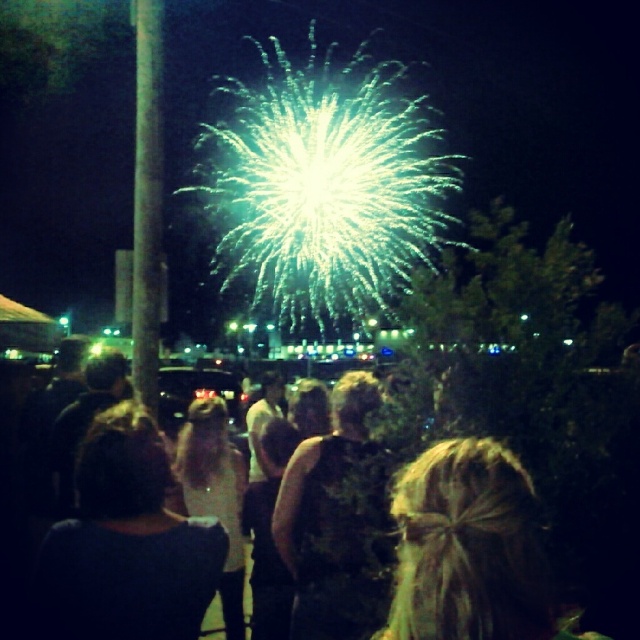
Question: Does smooth metallic pole at left appear over black fabric crowd at center?

Choices:
 (A) yes
 (B) no

Answer: (A)

Question: Among these objects, which one is farthest from the camera?

Choices:
 (A) smooth metallic pole at left
 (B) black fabric crowd at center

Answer: (A)

Question: Does smooth metallic pole at left have a greater width compared to black fabric crowd at center?

Choices:
 (A) no
 (B) yes

Answer: (B)

Question: Is smooth metallic pole at left to the right of black fabric crowd at center from the viewer's perspective?

Choices:
 (A) yes
 (B) no

Answer: (B)

Question: Which point is farther to the camera?

Choices:
 (A) black fabric crowd at center
 (B) smooth metallic pole at left

Answer: (B)

Question: Among these objects, which one is nearest to the camera?

Choices:
 (A) smooth metallic pole at left
 (B) black fabric crowd at center

Answer: (B)